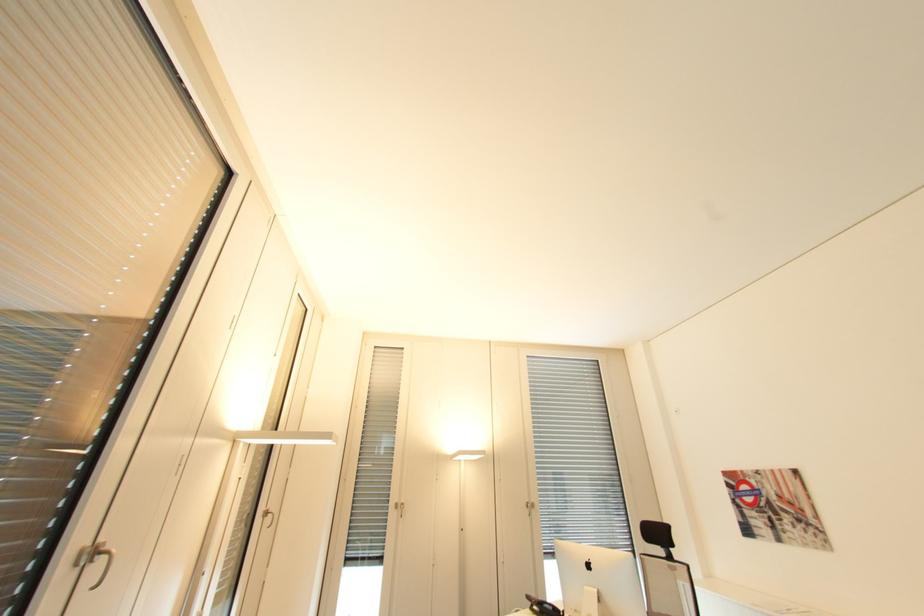
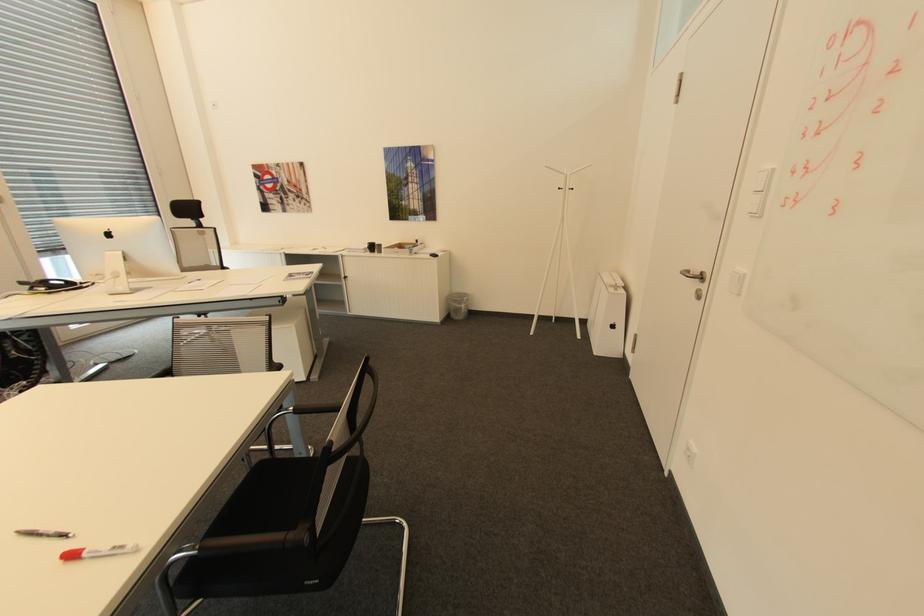
The images are taken continuously from a first-person perspective. In which direction is your viewpoint rotating?

The camera's rotation is toward right-down.